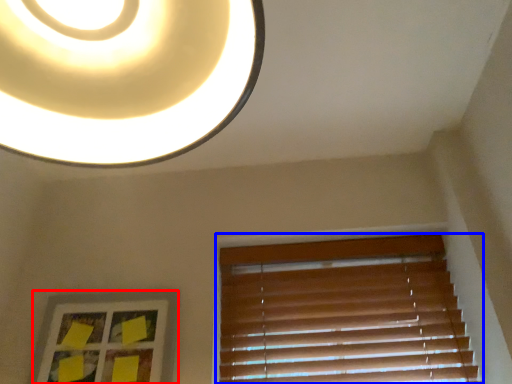
Question: Which point is closer to the camera, picture frame (highlighted by a red box) or window blind (highlighted by a blue box)?

Choices:
 (A) picture frame
 (B) window blind

Answer: (A)